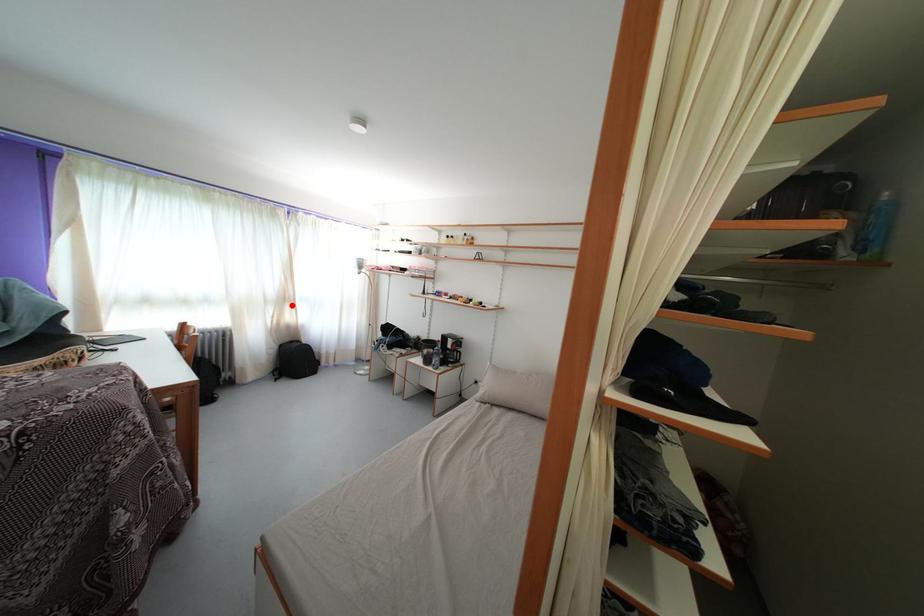
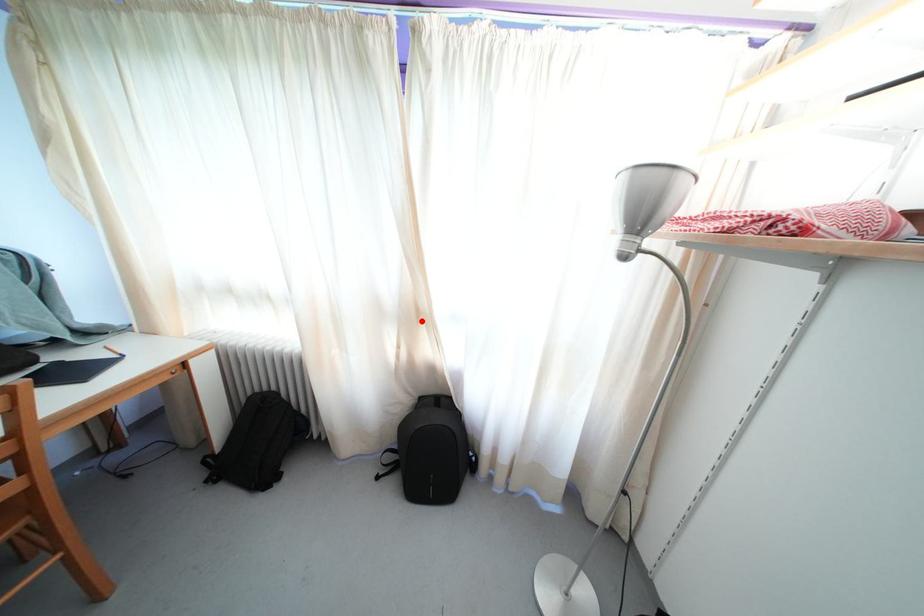
From the picture: I am providing you with two images of the same scene from different viewpoints. A red point is marked on the first image and another point is marked on the second image. Is the marked point in image1 the same physical position as the marked point in image2?

Yes